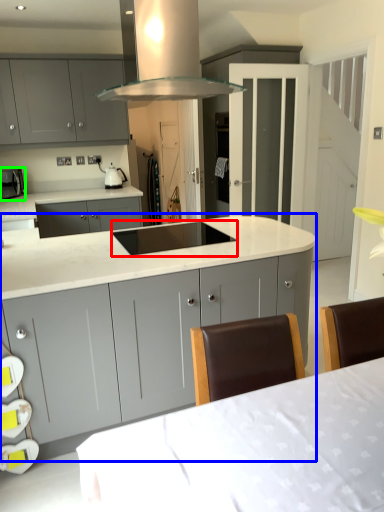
Question: Which is farther away from sink (highlighted by a red box)? cabinetry (highlighted by a blue box) or kitchen appliance (highlighted by a green box)?

Choices:
 (A) cabinetry
 (B) kitchen appliance

Answer: (B)